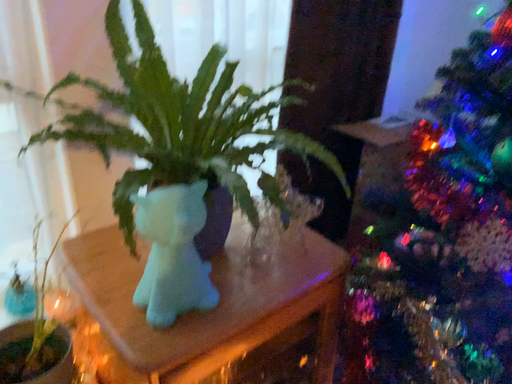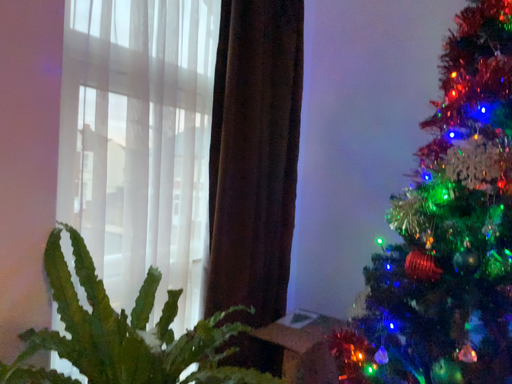
Question: How did the camera likely rotate when shooting the video?

Choices:
 (A) rotated downward
 (B) rotated upward

Answer: (B)